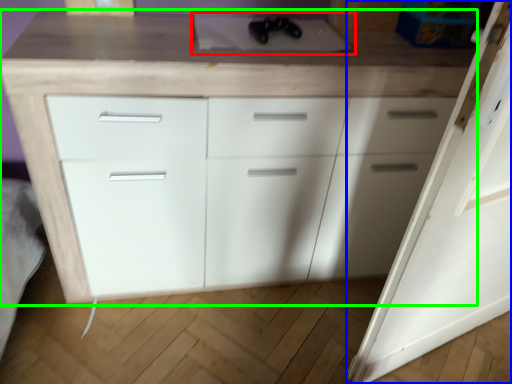
Question: Considering the real-world distances, which object is closest to sink (highlighted by a red box)? door (highlighted by a blue box) or chest of drawers (highlighted by a green box).

Choices:
 (A) door
 (B) chest of drawers

Answer: (B)